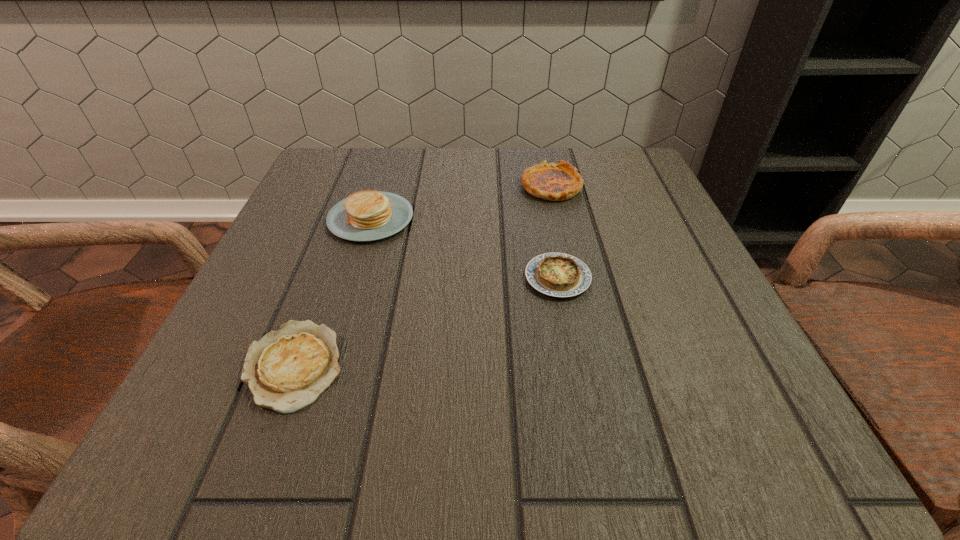
Where is `pancake situated at the far edge`? pancake situated at the far edge is located at coordinates (369, 215).

The width and height of the screenshot is (960, 540). In order to click on quiche located in the far edge section of the desktop in this screenshot , I will do `click(556, 182)`.

In order to click on object present at the near edge in this screenshot , I will do `click(286, 370)`.

The width and height of the screenshot is (960, 540). In order to click on pancake present at the left edge in this screenshot , I will do `click(369, 215)`.

I want to click on quiche present at the left edge, so click(x=286, y=370).

This screenshot has height=540, width=960. In order to click on object at the right edge in this screenshot , I will do `click(556, 182)`.

In order to click on object at the far left corner in this screenshot , I will do `click(369, 215)`.

Image resolution: width=960 pixels, height=540 pixels. Find the location of `object that is at the near left corner`. object that is at the near left corner is located at coordinates (286, 370).

Locate an element on the screen. The width and height of the screenshot is (960, 540). object present at the far right corner is located at coordinates [556, 182].

Identify the location of vacant space at the far edge. (507, 147).